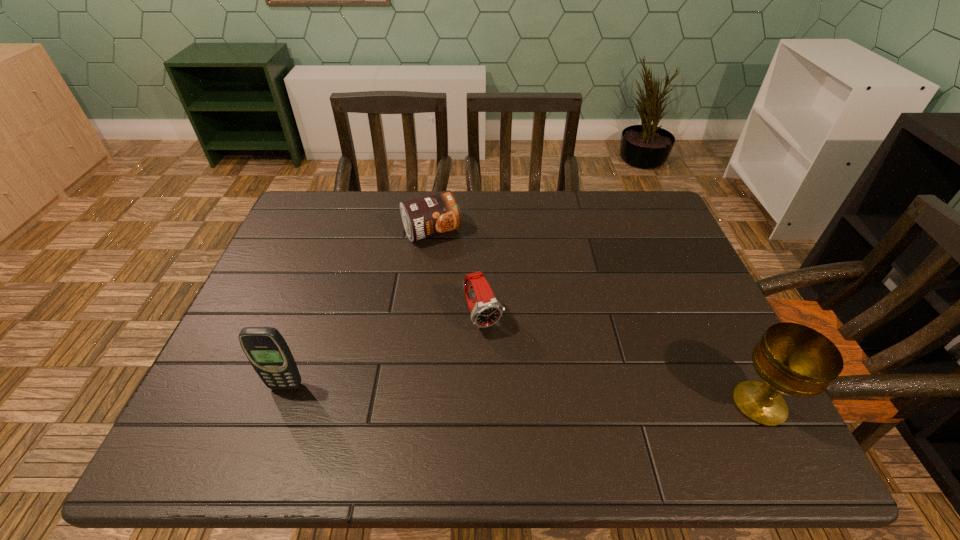
What are the coordinates of `free space between the chalice and the leftmost object` in the screenshot? It's located at (522, 395).

Identify the location of unoccupied area between the can and the cellular telephone. (359, 309).

Find the location of a particular element. empty space that is in between the watch and the leftmost object is located at coordinates (385, 352).

I want to click on vacant space that is in between the chalice and the leftmost object, so (522, 395).

Where is `vacant area that lies between the watch and the cellular telephone`? vacant area that lies between the watch and the cellular telephone is located at coordinates (385, 352).

You are a GUI agent. You are given a task and a screenshot of the screen. Output one action in this format:
    pyautogui.click(x=<x>, y=<y>)
    Task: Click on the empty space that is in between the third nearest object and the rightmost object
    The image size is (960, 540).
    Given the screenshot: What is the action you would take?
    click(621, 360)

The width and height of the screenshot is (960, 540). In order to click on free space that is in between the second farthest object and the chalice in this screenshot , I will do `click(621, 360)`.

Where is `object that is the third nearest to the chalice`? The width and height of the screenshot is (960, 540). object that is the third nearest to the chalice is located at coordinates (266, 349).

Locate which object is the second closest to the rightmost object. Please provide its 2D coordinates. Your answer should be formatted as a tuple, i.e. [(x, y)], where the tuple contains the x and y coordinates of a point satisfying the conditions above.

[(431, 215)]

What are the coordinates of `free space that satisfies the following two spatial constraints: 1. on the front side of the third nearest object; 2. on the right side of the chalice` in the screenshot? It's located at (484, 404).